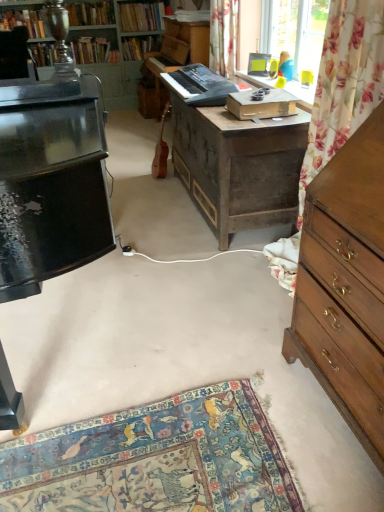
This screenshot has height=512, width=384. I want to click on vacant area in front of wooden desk at center, so click(202, 277).